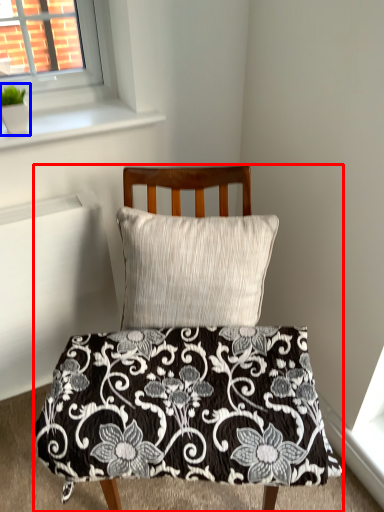
Question: Which object appears farthest to the camera in this image, furniture (highlighted by a red box) or plant (highlighted by a blue box)?

Choices:
 (A) furniture
 (B) plant

Answer: (B)